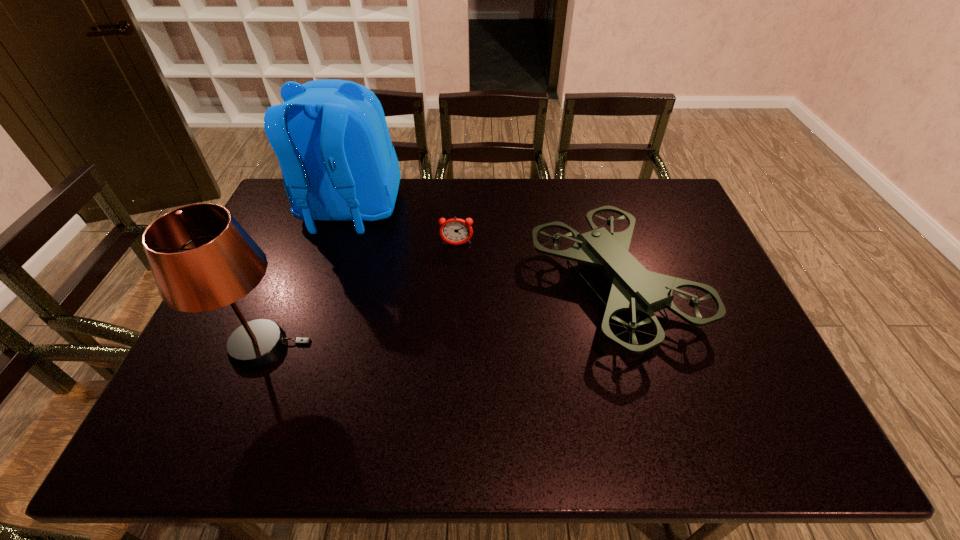
Locate an element on the screen. vacant space that is in between the backpack and the rightmost object is located at coordinates (482, 249).

The image size is (960, 540). Find the location of `vacant area that lies between the lampshade and the alarm clock`. vacant area that lies between the lampshade and the alarm clock is located at coordinates (360, 295).

The height and width of the screenshot is (540, 960). I want to click on vacant space that's between the third object from left to right and the second shortest object, so click(536, 266).

What are the coordinates of `free space between the shortest object and the rightmost object` in the screenshot? It's located at click(536, 266).

The image size is (960, 540). Identify the location of free space between the lampshade and the backpack. (306, 278).

At what (x,y) coordinates should I click in order to perform the action: click on vacant space that's between the backpack and the drone. Please return your answer as a coordinate pair (x, y). Looking at the image, I should click on (482, 249).

The height and width of the screenshot is (540, 960). In order to click on vacant space that's between the backpack and the lampshade in this screenshot , I will do `click(306, 278)`.

Where is `empty location between the backpack and the lampshade`? This screenshot has height=540, width=960. empty location between the backpack and the lampshade is located at coordinates (306, 278).

Locate an element on the screen. Image resolution: width=960 pixels, height=540 pixels. empty location between the shortest object and the lampshade is located at coordinates (360, 295).

The height and width of the screenshot is (540, 960). Identify the location of the second closest object to the backpack. (201, 258).